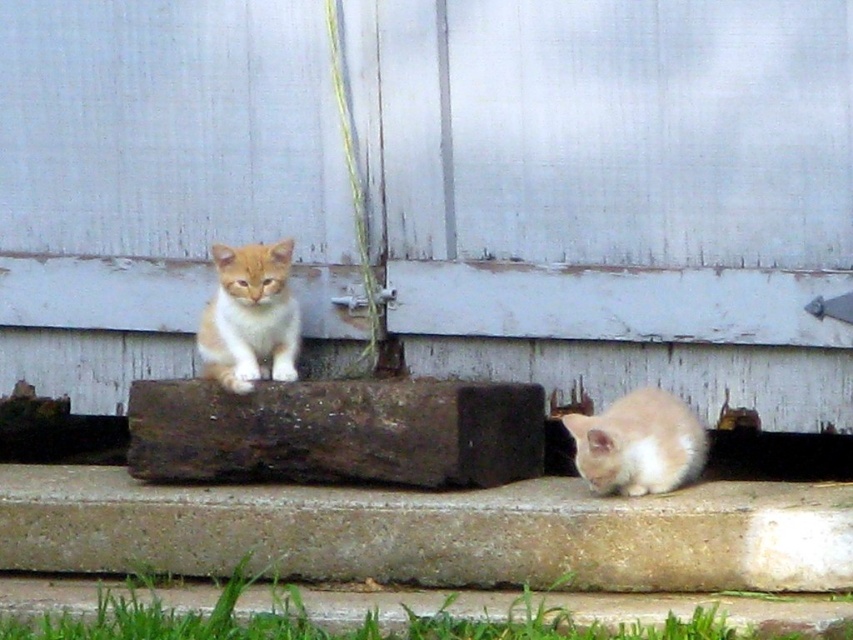
You are a photographer trying to capture both kittens in a single frame. Given that the camera can only focus on objects within a 50 cm width, will both the orange fur kitten at center and the soft orange fur at lower right fit within the camera frame?

The orange fur kitten at center is narrower than the soft orange fur at lower right. Since the camera can focus on objects within a 50 cm width, both kittens can fit as long as their combined width does not exceed 50 cm. However, the exact answer depends on their individual widths. The description only states the relative sizes, not the absolute measurements.

You are a photographer trying to capture both kittens in a single shot. Since you want to focus on the orange fur kitten at center, which is closer to you, will the soft orange fur at lower right also be in focus if your camera has a depth of field that can cover 1 meter?

The orange fur kitten at center is further to the viewer than the soft orange fur at lower right. Since the camera can cover 1 meter, and the distance between them is not specified, but the description says the kitten is further, so maybe within 1 meter. Therefore, the soft orange fur at lower right will likely be in focus.

You are a photographer trying to capture both the orange fur kitten at center and the soft orange fur at lower right in a single shot. Based on their positions, which kitten is higher up in the frame?

The orange fur kitten at center is positioned over the soft orange fur at lower right, so it is higher up in the frame.